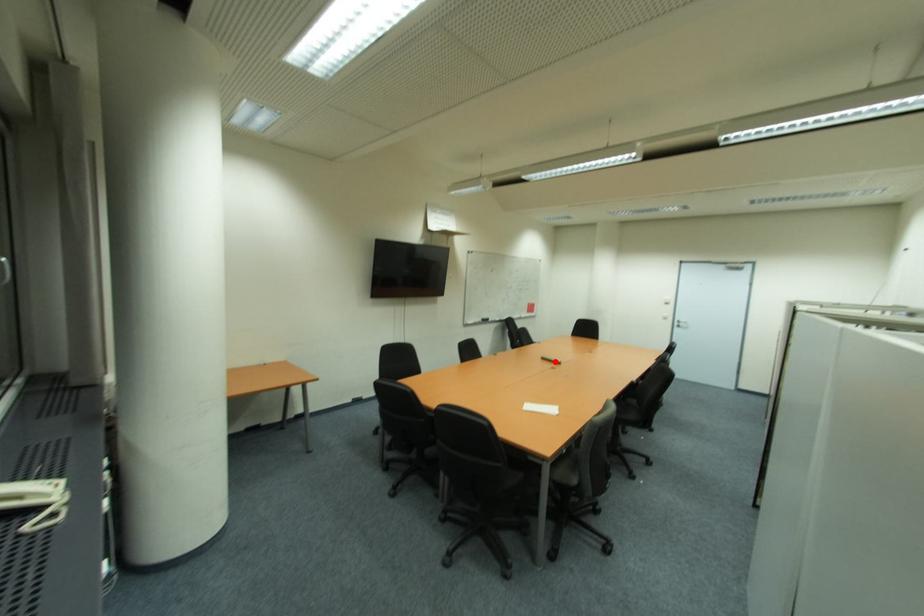
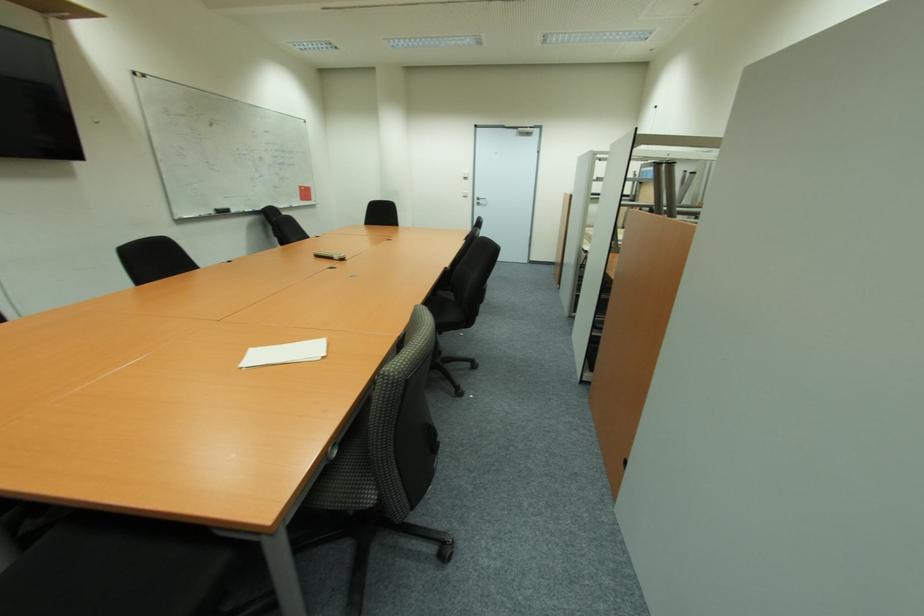
Question: I am providing you with two images of the same scene from different viewpoints. A red point is marked on the first image. At the location where the point appears in image 1, is it still visible in image 2?

Choices:
 (A) Yes
 (B) No

Answer: (A)